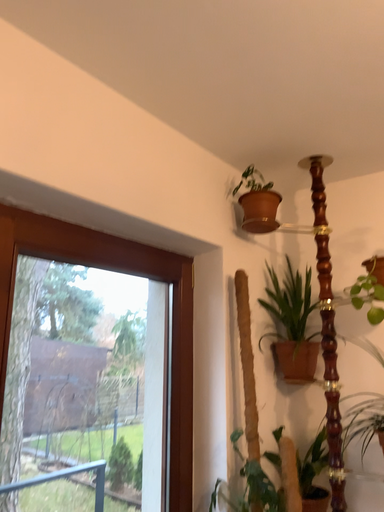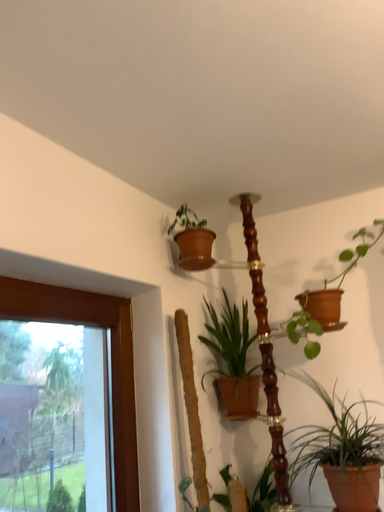
Question: How did the camera likely rotate when shooting the video?

Choices:
 (A) rotated left
 (B) rotated right

Answer: (B)